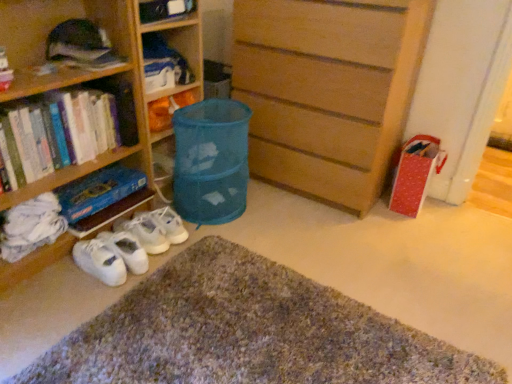
Where is `unoccupied region to the right of blue fabric laundry basket at center`? The image size is (512, 384). unoccupied region to the right of blue fabric laundry basket at center is located at coordinates (276, 209).